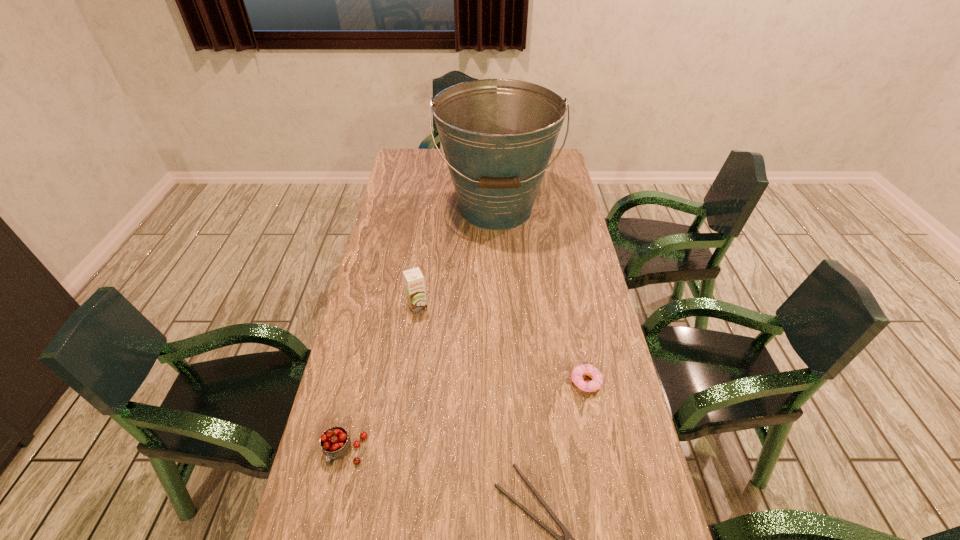
Locate an element on the screen. This screenshot has width=960, height=540. bucket is located at coordinates (498, 135).

This screenshot has height=540, width=960. In order to click on the tallest object in this screenshot , I will do pyautogui.click(x=498, y=135).

Find the location of a particular element. The width and height of the screenshot is (960, 540). the fourth nearest object is located at coordinates (414, 281).

Find the location of a particular element. This screenshot has height=540, width=960. chocolate milk is located at coordinates (414, 281).

I want to click on the third tallest object, so click(x=335, y=442).

This screenshot has height=540, width=960. I want to click on the leftmost object, so click(x=335, y=442).

The image size is (960, 540). I want to click on the second shortest object, so [x=584, y=369].

Find the location of `the third nearest object`. the third nearest object is located at coordinates (584, 369).

This screenshot has height=540, width=960. I want to click on vacant space situated with the handle on opposite sides of the tallest object, so click(500, 298).

Where is `free space located 0.150m on the right of the chocolate milk`? This screenshot has width=960, height=540. free space located 0.150m on the right of the chocolate milk is located at coordinates (478, 306).